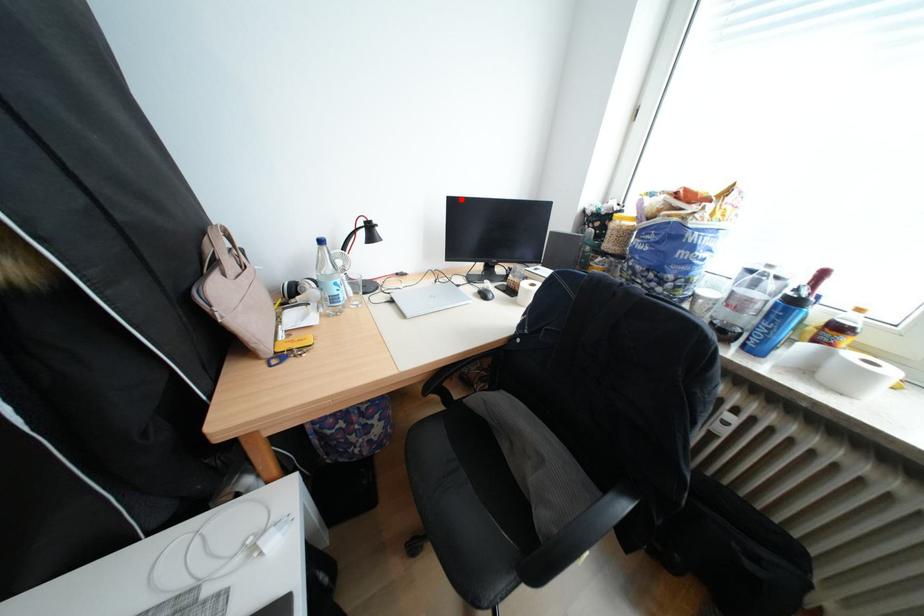
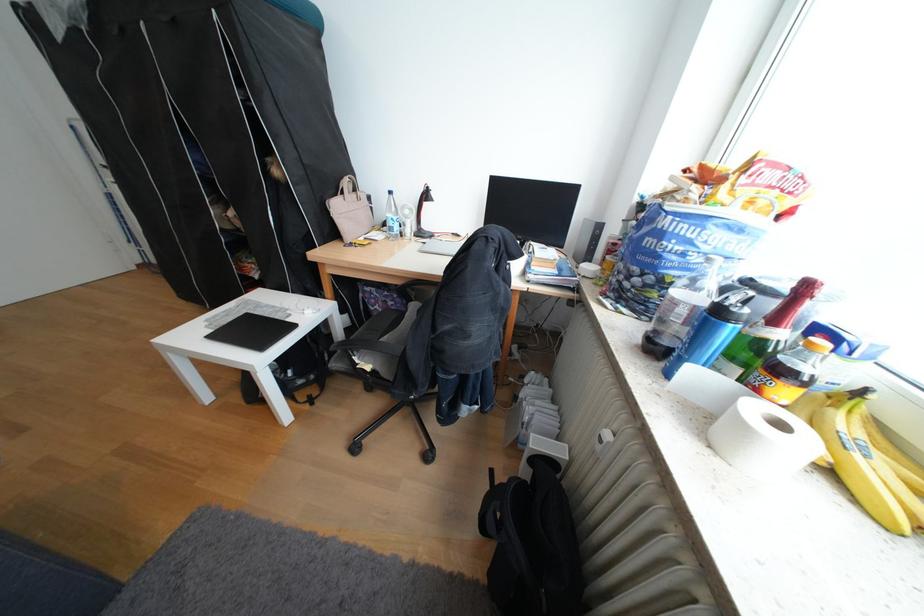
Question: I am providing you with two images of the same scene from different viewpoints. In image1, a red point is highlighted. Considering the same 3D point in image2, which of the following is correct?

Choices:
 (A) It is closer
 (B) It is farther

Answer: (A)